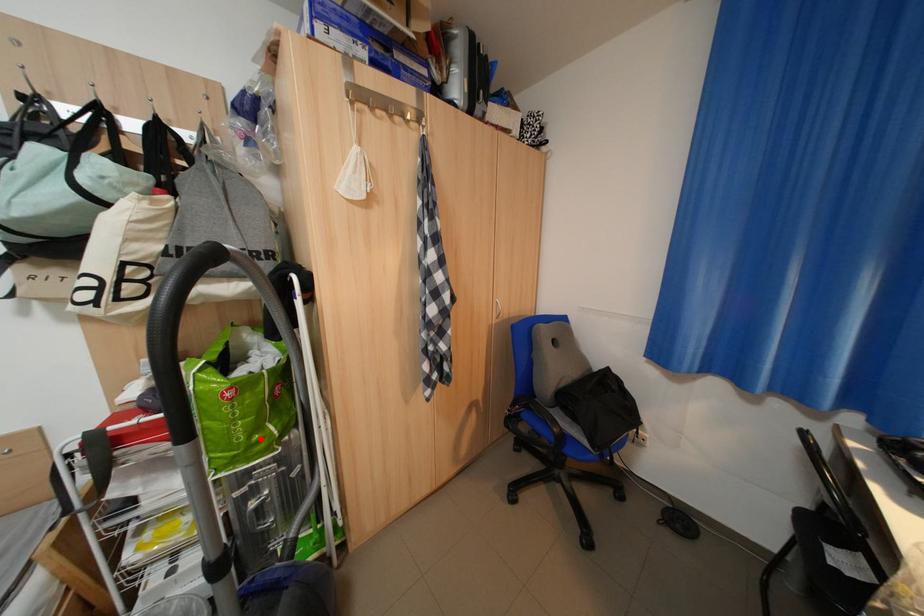
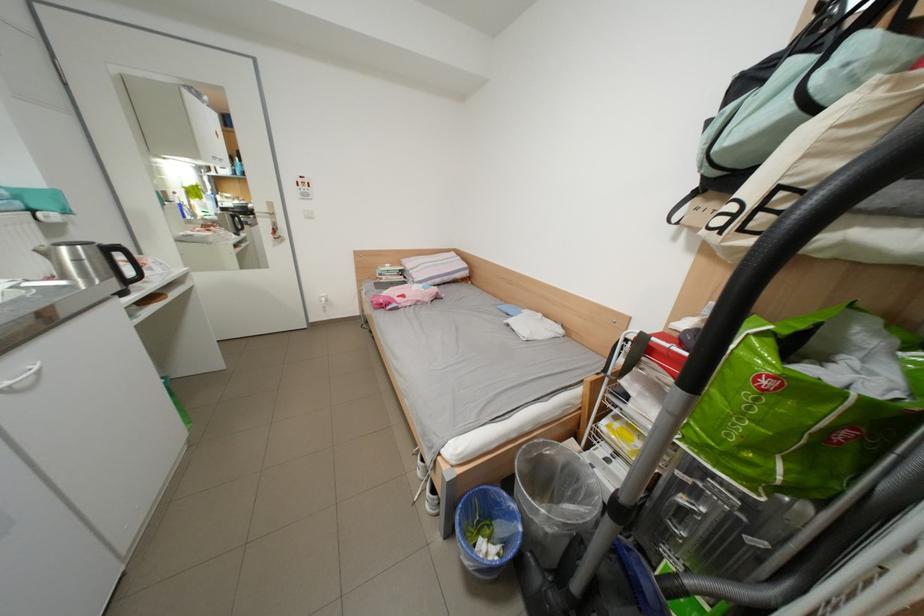
In the second image, find the point that corresponds to the highlighted location in the first image.

(754, 448)